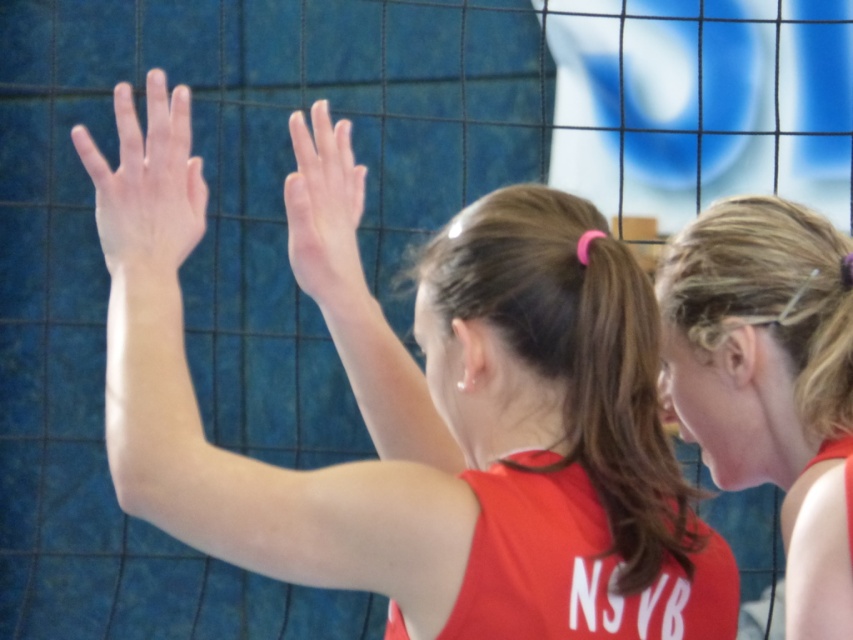
Does matte red tank top at upper right have a greater width compared to pale skin/hair at upper center?

Correct, the width of matte red tank top at upper right exceeds that of pale skin/hair at upper center.

Which is more to the left, matte red tank top at upper right or pale skin/hair at upper center?

pale skin/hair at upper center

Is point (732, 381) closer to camera compared to point (90, 173)?

Yes, it is in front of point (90, 173).

Locate an element on the screen. This screenshot has width=853, height=640. matte red tank top at upper right is located at coordinates (769, 380).

Can you confirm if matte red tank top at upper right is shorter than smooth skin hand at center?

No, matte red tank top at upper right is not shorter than smooth skin hand at center.

Who is positioned more to the left, matte red tank top at upper right or smooth skin hand at center?

smooth skin hand at center is more to the left.

Where is `matte red tank top at upper right`? This screenshot has width=853, height=640. matte red tank top at upper right is located at coordinates (769, 380).

The width and height of the screenshot is (853, 640). Identify the location of matte red tank top at upper right. (769, 380).

Who is positioned more to the left, matte red jersey at center or matte red tank top at upper right?

Positioned to the left is matte red jersey at center.

Can you confirm if matte red jersey at center is thinner than matte red tank top at upper right?

In fact, matte red jersey at center might be wider than matte red tank top at upper right.

Where is `matte red jersey at center`? matte red jersey at center is located at coordinates (425, 420).